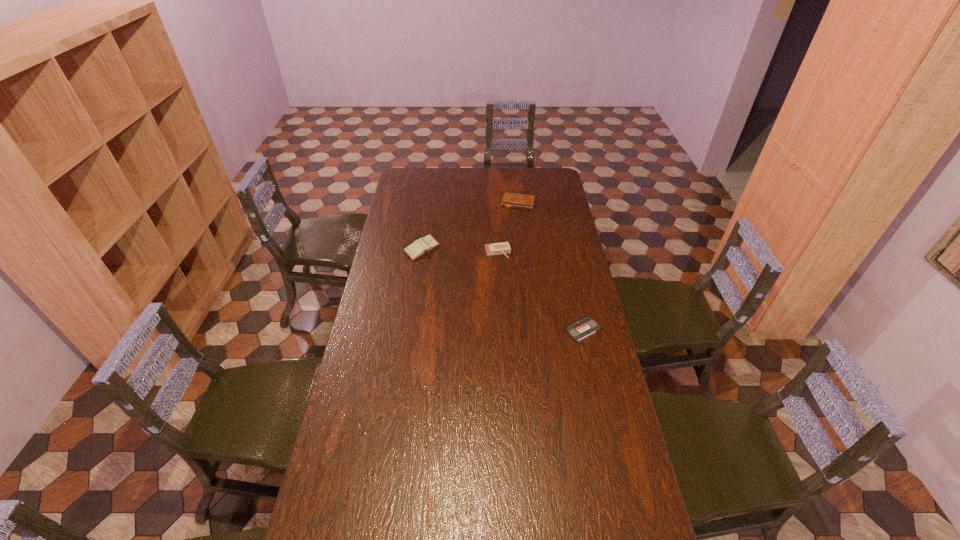
The width and height of the screenshot is (960, 540). Identify the location of free area in between the matchbox and the taller diary. (460, 251).

Select which object appears as the third closest to the taller diary. Please provide its 2D coordinates. Your answer should be formatted as a tuple, i.e. [(x, y)], where the tuple contains the x and y coordinates of a point satisfying the conditions above.

[(587, 326)]

You are a GUI agent. You are given a task and a screenshot of the screen. Output one action in this format:
    pyautogui.click(x=<x>, y=<y>)
    Task: Click on the second closest object relative to the third shortest object
    This screenshot has width=960, height=540.
    Given the screenshot: What is the action you would take?
    pyautogui.click(x=512, y=200)

Where is `free space that satisfies the following two spatial constraints: 1. on the back side of the third tallest object; 2. on the left side of the taller diary`? This screenshot has width=960, height=540. free space that satisfies the following two spatial constraints: 1. on the back side of the third tallest object; 2. on the left side of the taller diary is located at coordinates [429, 202].